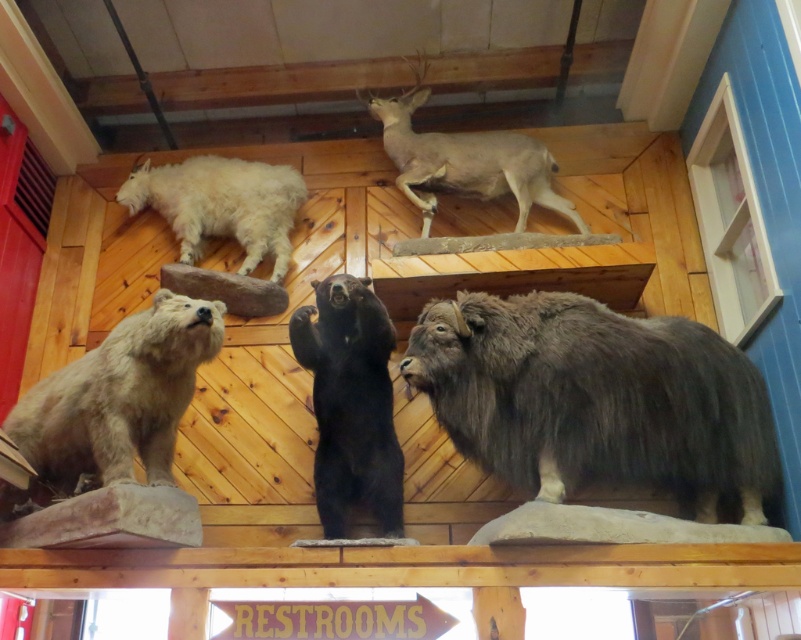
You are standing in front of the display and want to touch the light brown fur bear at lower left and the white fluffy goat at upper left. Which one can you reach without moving your position?

The light brown fur bear at lower left is closer to the viewer than the white fluffy goat at upper left, so you can reach the light brown fur bear at lower left without moving your position.

You are an interior designer assessing the layout of the taxidermy display. You need to determine if the black furry bear at center is placed below the light brown fur deer at upper center. Is this arrangement accurate based on the scene?

Yes, the black furry bear at center is positioned under the light brown fur deer at upper center, so the arrangement is accurate.

You are an interior designer arranging a rustic display. You need to place a new sculpture between the light brown fur bear at lower left and the white fluffy goat at upper left. Where should you position it to maintain symmetry?

To maintain symmetry between the light brown fur bear at lower left and the white fluffy goat at upper left, position the sculpture centrally along the line connecting their positions, ensuring it is equidistant from both objects.